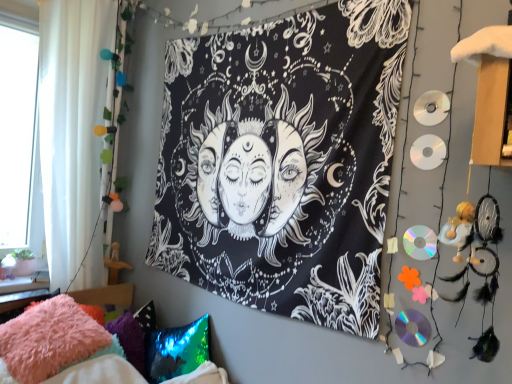
Question: Is fuzzy pink pillow at lower left at the back of holographic sequin pillow at lower left, marked as the 2th pillow in a left-to-right arrangement?

Choices:
 (A) no
 (B) yes

Answer: (B)

Question: From a real-world perspective, is holographic sequin pillow at lower left, marked as the 2th pillow in a left-to-right arrangement, positioned under fuzzy pink pillow at lower left based on gravity?

Choices:
 (A) no
 (B) yes

Answer: (A)

Question: Is holographic sequin pillow at lower left, the 1th pillow when ordered from right to left, in contact with fuzzy pink pillow at lower left?

Choices:
 (A) yes
 (B) no

Answer: (B)

Question: Is fuzzy pink pillow at lower left located within holographic sequin pillow at lower left, marked as the 2th pillow in a left-to-right arrangement?

Choices:
 (A) yes
 (B) no

Answer: (B)

Question: Can you confirm if holographic sequin pillow at lower left, the 1th pillow when ordered from right to left, is wider than fuzzy pink pillow at lower left?

Choices:
 (A) yes
 (B) no

Answer: (B)

Question: Is holographic sequin pillow at lower left, the 1th pillow when ordered from right to left, behind fuzzy pink pillow at lower left?

Choices:
 (A) no
 (B) yes

Answer: (B)

Question: Is the depth of white sheer curtain at left less than that of black fabric tapestry at center?

Choices:
 (A) yes
 (B) no

Answer: (B)

Question: Is white sheer curtain at left to the right of black fabric tapestry at center from the viewer's perspective?

Choices:
 (A) no
 (B) yes

Answer: (A)

Question: Is white sheer curtain at left wider than black fabric tapestry at center?

Choices:
 (A) no
 (B) yes

Answer: (B)

Question: Does white sheer curtain at left have a lesser width compared to black fabric tapestry at center?

Choices:
 (A) yes
 (B) no

Answer: (B)

Question: Considering the relative sizes of white sheer curtain at left and black fabric tapestry at center in the image provided, is white sheer curtain at left taller than black fabric tapestry at center?

Choices:
 (A) yes
 (B) no

Answer: (A)

Question: From the image's perspective, is white sheer curtain at left beneath black fabric tapestry at center?

Choices:
 (A) yes
 (B) no

Answer: (B)

Question: Is fluffy pink pillow at lower left, which is the first pillow in left-to-right order, not close to white sheer curtain at left?

Choices:
 (A) no
 (B) yes

Answer: (A)